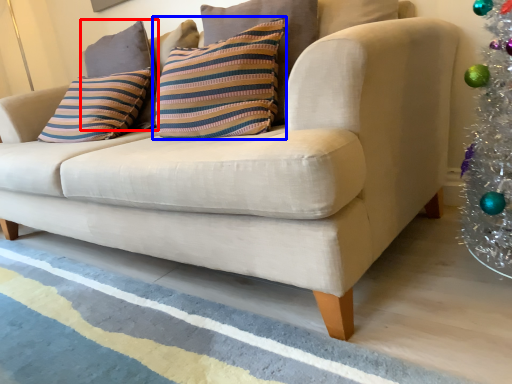
Question: Among these objects, which one is nearest to the camera, pillow (highlighted by a red box) or pillow (highlighted by a blue box)?

Choices:
 (A) pillow
 (B) pillow

Answer: (B)